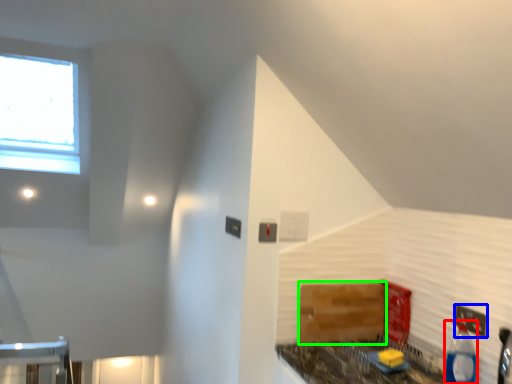
Question: Which object is positioned closest to bottle (highlighted by a red box)? Select from electric outlet (highlighted by a blue box) and cabinetry (highlighted by a green box).

Choices:
 (A) electric outlet
 (B) cabinetry

Answer: (A)